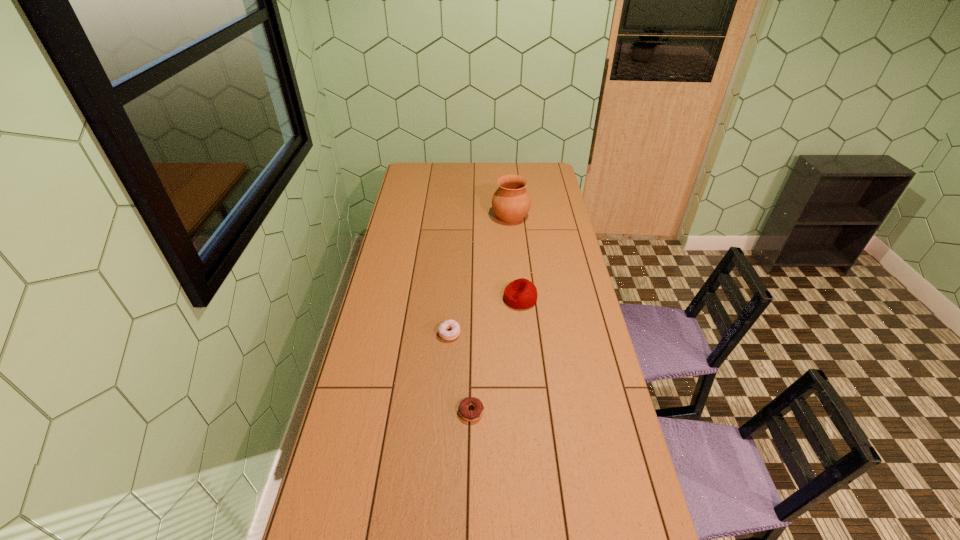
Locate an element on the screen. vacant region located 0.240m on the seat area of the beanbag is located at coordinates (445, 299).

Where is `free space located 0.270m on the seat area of the beanbag`? This screenshot has width=960, height=540. free space located 0.270m on the seat area of the beanbag is located at coordinates (439, 299).

The image size is (960, 540). What are the coordinates of `vacant space situated on the front of the taller doughnut` in the screenshot? It's located at (445, 387).

This screenshot has height=540, width=960. Find the location of `vacant space located on the front of the right doughnut`. vacant space located on the front of the right doughnut is located at coordinates [x=470, y=463].

Identify the location of free space at the far edge of the desktop. (439, 170).

At what (x,y) coordinates should I click in order to perform the action: click on free region at the left edge. Please return your answer as a coordinate pair (x, y). The height and width of the screenshot is (540, 960). Looking at the image, I should click on (355, 478).

At what (x,y) coordinates should I click in order to perform the action: click on vacant space at the right edge of the desktop. Please return your answer as a coordinate pair (x, y). Looking at the image, I should click on (641, 509).

I want to click on blank space at the far right corner of the desktop, so click(x=547, y=165).

Image resolution: width=960 pixels, height=540 pixels. I want to click on vacant point located between the leftmost object and the nearer doughnut, so click(x=460, y=373).

Where is `unoccupied position between the nearest object and the farthest object`? unoccupied position between the nearest object and the farthest object is located at coordinates (491, 314).